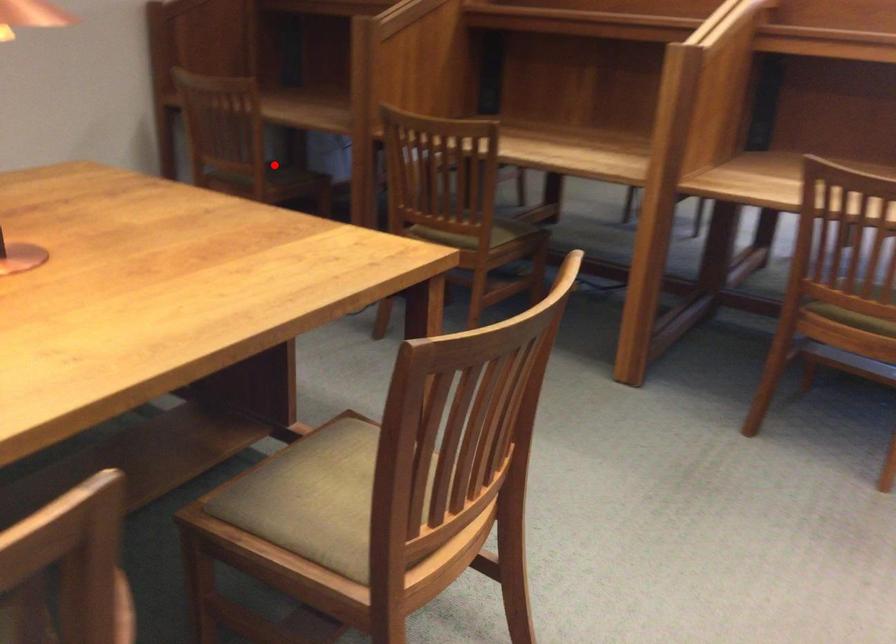
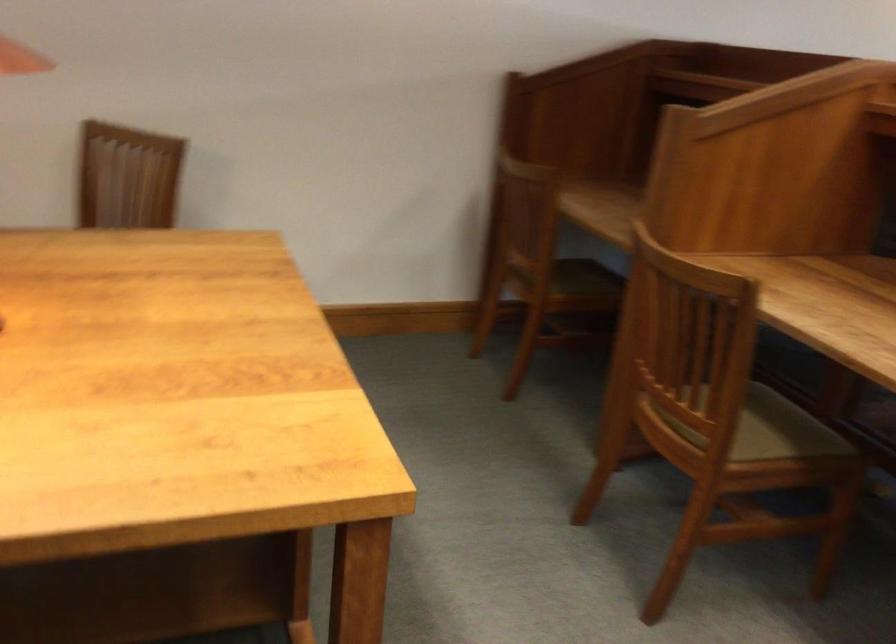
The point at the highlighted location is marked in the first image. Where is the corresponding point in the second image?

(572, 277)